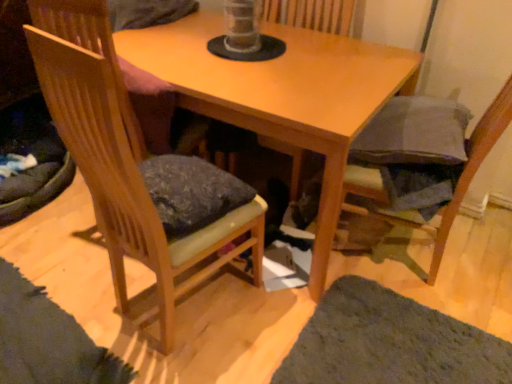
Question: From the image's perspective, is dark gray fabric cushion at lower right, which is the 1th chair from right to left, located above or below green shaggy rug at lower right?

Choices:
 (A) above
 (B) below

Answer: (A)

Question: Is dark gray fabric cushion at lower right, which is the 1th chair from right to left, in front of or behind green shaggy rug at lower right in the image?

Choices:
 (A) behind
 (B) front

Answer: (B)

Question: Considering the real-world distances, which object is closest to the wooden swivel chair at center?

Choices:
 (A) dark gray fabric cushion at lower right, which is the 1th chair from right to left
 (B) wooden table at center
 (C) green shaggy rug at lower right
 (D) wooden chair at left, which appears as the 2th chair when viewed from the right

Answer: (B)

Question: Considering the real-world distances, which object is closest to the dark gray fabric cushion at lower right, acting as the 2th chair starting from the left?

Choices:
 (A) wooden chair at left, acting as the first chair starting from the left
 (B) wooden swivel chair at center
 (C) wooden table at center
 (D) green shaggy rug at lower right

Answer: (D)